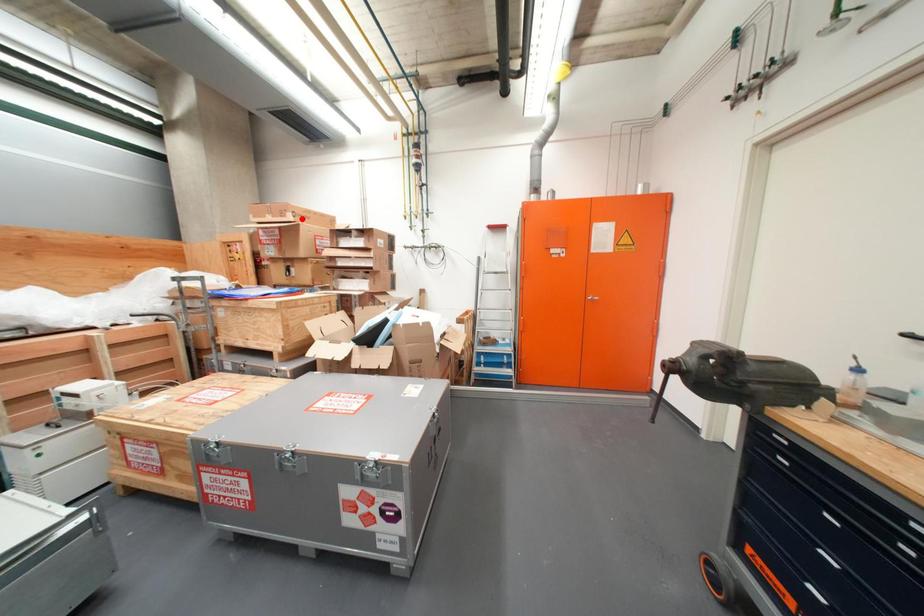
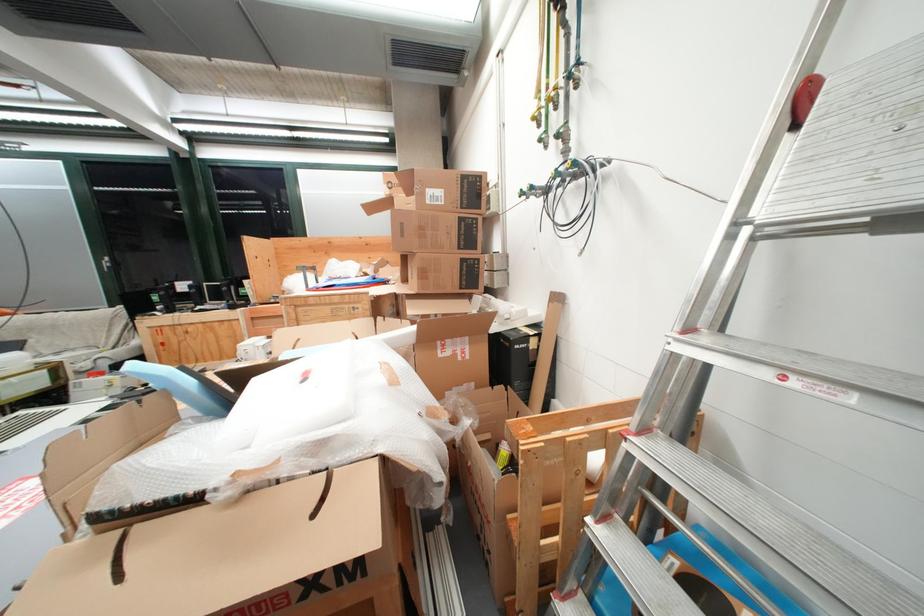
Question: A red point is marked in image1. In image2, is the corresponding 3D point closer to the camera or farther? Reply with the corresponding letter.

Choices:
 (A) The corresponding 3D point is closer.
 (B) The corresponding 3D point is farther.

Answer: (A)